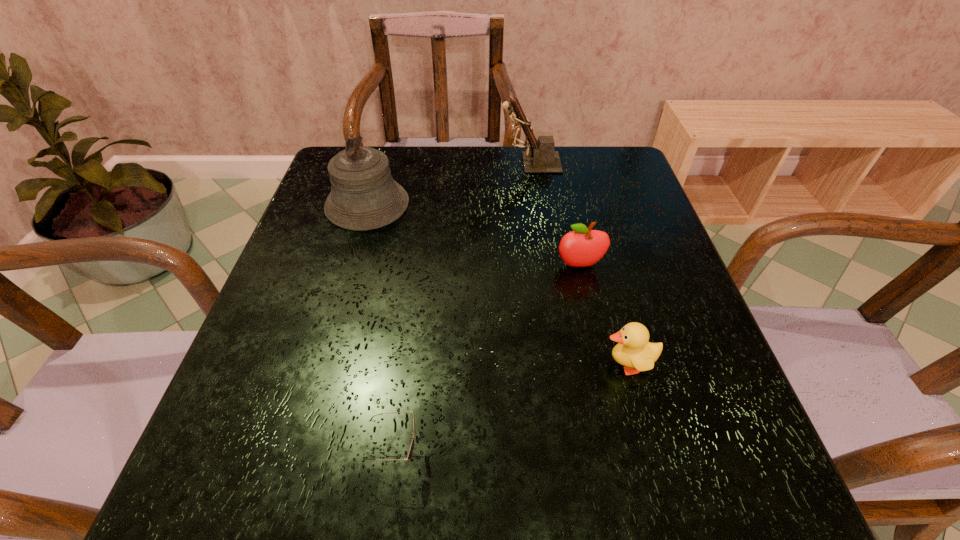
Where is `apple present at the right edge`? apple present at the right edge is located at coordinates (581, 247).

You are a GUI agent. You are given a task and a screenshot of the screen. Output one action in this format:
    pyautogui.click(x=<x>, y=<y>)
    Task: Click on the duckling that is at the right edge
    The width and height of the screenshot is (960, 540).
    Given the screenshot: What is the action you would take?
    633,350

Where is `object that is at the far left corner`? The image size is (960, 540). object that is at the far left corner is located at coordinates (364, 196).

Locate an element on the screen. free space at the far edge of the desktop is located at coordinates (449, 164).

Locate an element on the screen. The image size is (960, 540). vacant space at the left edge of the desktop is located at coordinates (301, 380).

Locate an element on the screen. blank area at the right edge is located at coordinates (622, 284).

This screenshot has width=960, height=540. In the image, there is a desktop. Identify the location of vacant region at the near right corner. (696, 472).

Image resolution: width=960 pixels, height=540 pixels. I want to click on vacant space in between the figurine and the shortest object, so point(463,308).

The width and height of the screenshot is (960, 540). In order to click on vacant area that lies between the apple and the shortest object in this screenshot , I will do `click(488, 360)`.

Where is `free point between the duckling and the third nearest object`? The height and width of the screenshot is (540, 960). free point between the duckling and the third nearest object is located at coordinates (604, 315).